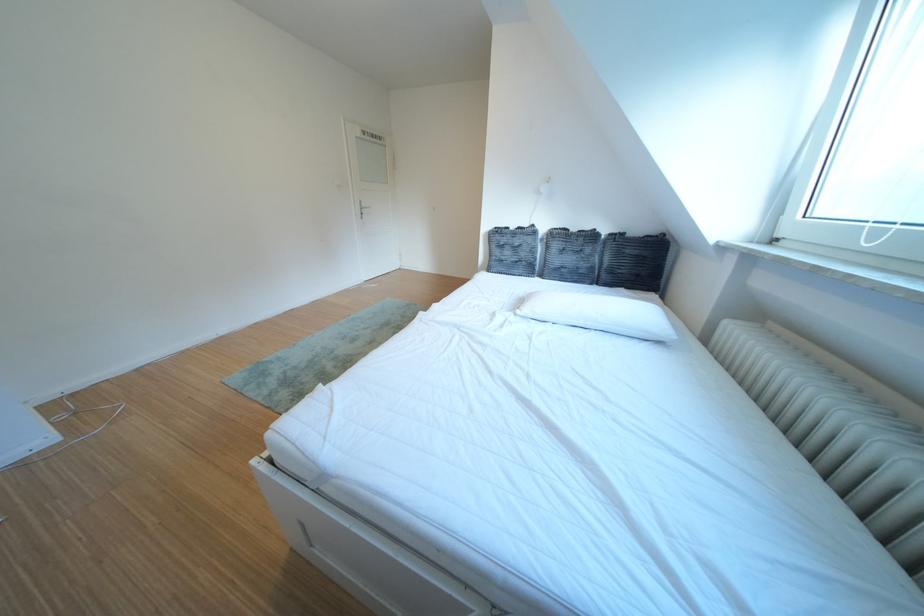
Where would you pull the white door handle? Please return your answer as a coordinate pair (x, y).

(362, 209)